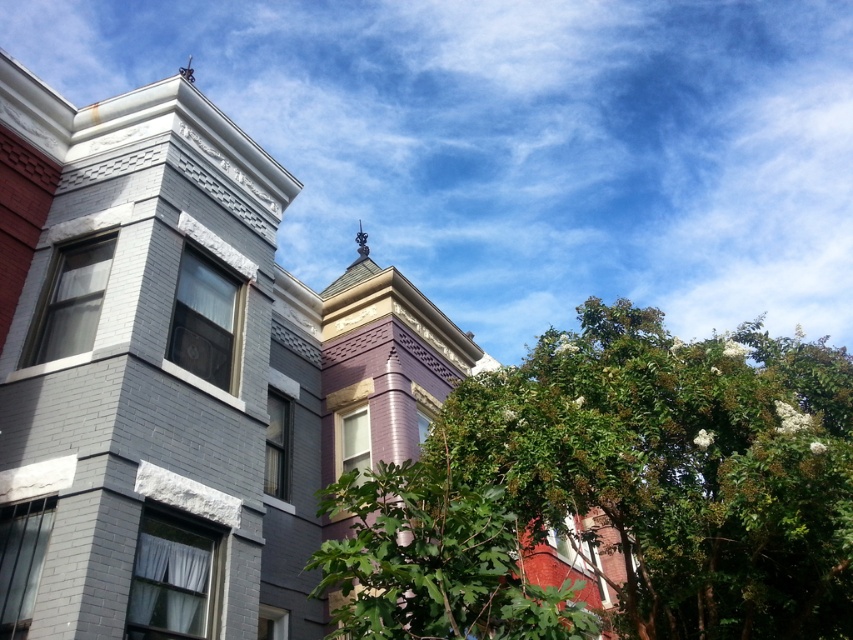
Question: Where is green leafy tree at center located in relation to green leafy tree at lower right in the image?

Choices:
 (A) left
 (B) right

Answer: (B)

Question: Is green leafy tree at center positioned before green leafy tree at lower right?

Choices:
 (A) no
 (B) yes

Answer: (A)

Question: Can you confirm if green leafy tree at center is positioned to the left of green leafy tree at lower right?

Choices:
 (A) no
 (B) yes

Answer: (A)

Question: Which object appears closest to the camera in this image?

Choices:
 (A) green leafy tree at lower right
 (B) green leafy tree at center

Answer: (A)